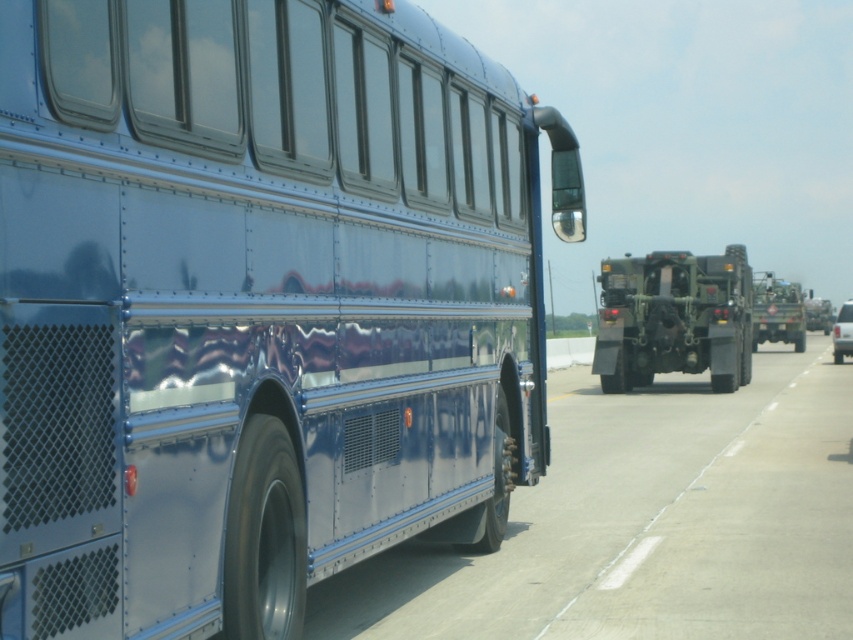
You are standing at the point labeled point (x=83, y=403) and want to cross the road to the other side. The road is 6 meters wide. Can you safely cross without stepping into the road?

The distance between point (x=83, y=403) and the viewer is 3.39 meters. Since the road is 6 meters wide, you are halfway across the road. To safely reach the other side, you need to cover the remaining 2.61 meters. However, without knowing traffic conditions or your speed, it is difficult to guarantee safety. Proceed with caution and ensure no vehicles are approaching before crossing.

You are a pedestrian standing on the side of the road. You see the glossy blue bus at center and the matte green military vehicle at center. Which vehicle is closer to you?

The glossy blue bus at center is closer to you because it is in front of the matte green military vehicle at center.